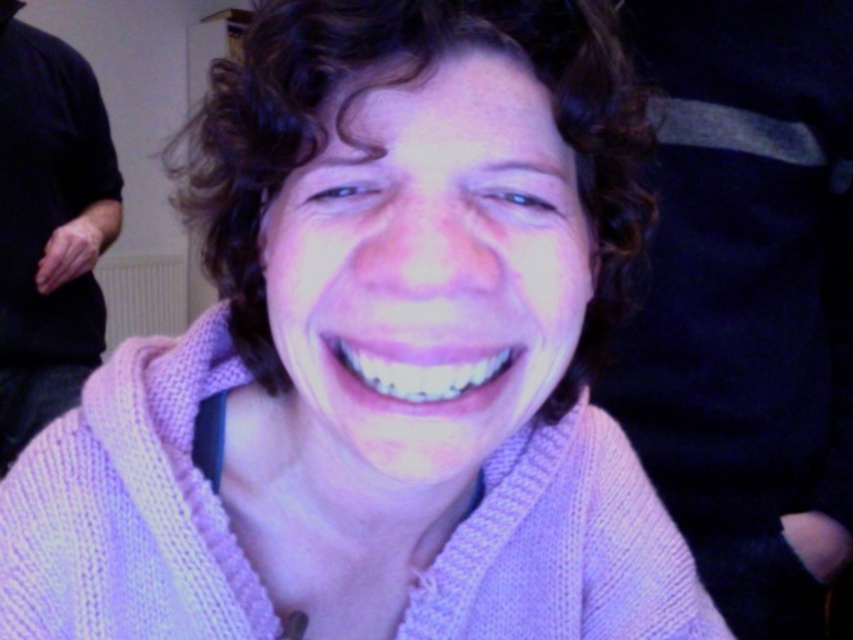
Question: From the image, what is the correct spatial relationship of curly brown hair at center in relation to pink knitted sweater at left?

Choices:
 (A) above
 (B) below

Answer: (B)

Question: Which point appears farthest from the camera in this image?

Choices:
 (A) (27, 328)
 (B) (643, 157)

Answer: (A)

Question: Does curly brown hair at center appear on the left side of pink knitted sweater at left?

Choices:
 (A) no
 (B) yes

Answer: (A)

Question: Is curly brown hair at center below pink knitted sweater at left?

Choices:
 (A) yes
 (B) no

Answer: (A)